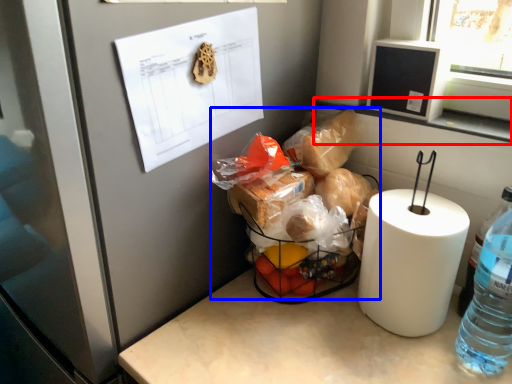
Question: Which object is further to the camera taking this photo, window sill (highlighted by a red box) or waste (highlighted by a blue box)?

Choices:
 (A) window sill
 (B) waste

Answer: (A)